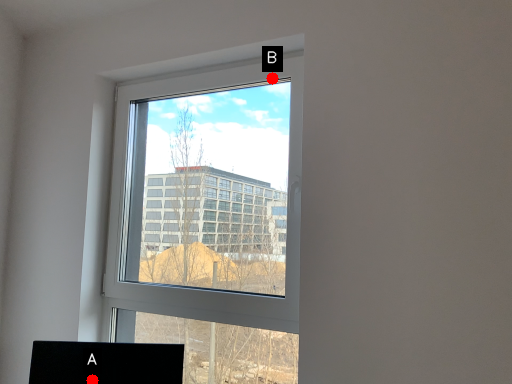
Question: Two points are circled on the image, labeled by A and B beside each circle. Which point is closer to the camera?

Choices:
 (A) A is closer
 (B) B is closer

Answer: (A)